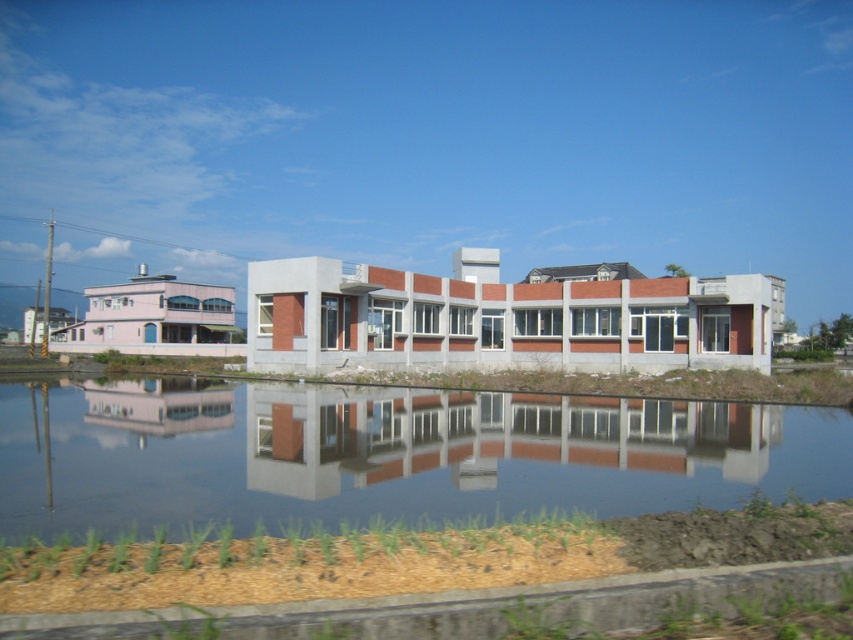
You are a photographer planning to capture the reflection of the smooth concrete building at center in the smooth reflective water at center. Given that the water is wider than the building, can you frame the entire building within the water for a perfect reflection shot?

The smooth reflective water at center is wider than the smooth concrete building at center, so yes, you can frame the entire building within the water for a perfect reflection shot since the water spans a greater width than the building.

You are standing on the strip of land in front of the smooth reflective water at center and want to reach the smooth concrete building at center. Is the building behind the water or in front of it?

The smooth reflective water at center is in front of the smooth concrete building at center, so the building is behind the water.